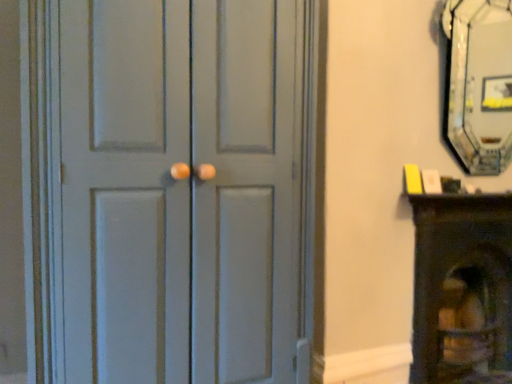
Question: Is matte gray door at center aimed at wooden fireplace at right?

Choices:
 (A) no
 (B) yes

Answer: (A)

Question: Does matte gray door at center have a lesser width compared to wooden fireplace at right?

Choices:
 (A) yes
 (B) no

Answer: (B)

Question: Is matte gray door at center behind wooden fireplace at right?

Choices:
 (A) yes
 (B) no

Answer: (B)

Question: From a real-world perspective, is matte gray door at center under wooden fireplace at right?

Choices:
 (A) no
 (B) yes

Answer: (A)

Question: Are matte gray door at center and wooden fireplace at right far apart?

Choices:
 (A) yes
 (B) no

Answer: (A)

Question: Looking at their shapes, would you say matte gray door at center is wider or thinner than wooden fireplace at right?

Choices:
 (A) wide
 (B) thin

Answer: (A)

Question: From a real-world perspective, is matte gray door at center positioned above or below wooden fireplace at right?

Choices:
 (A) below
 (B) above

Answer: (B)

Question: In terms of height, does matte gray door at center look taller or shorter compared to wooden fireplace at right?

Choices:
 (A) short
 (B) tall

Answer: (B)

Question: From the image's perspective, is matte gray door at center positioned above or below wooden fireplace at right?

Choices:
 (A) above
 (B) below

Answer: (A)

Question: From the image's perspective, is matte gray door at center positioned above or below black glass fireplace at upper right?

Choices:
 (A) above
 (B) below

Answer: (B)

Question: From a real-world perspective, relative to black glass fireplace at upper right, is matte gray door at center vertically above or below?

Choices:
 (A) below
 (B) above

Answer: (A)

Question: In terms of height, does matte gray door at center look taller or shorter compared to black glass fireplace at upper right?

Choices:
 (A) tall
 (B) short

Answer: (A)

Question: Based on their positions, is matte gray door at center located to the left or right of black glass fireplace at upper right?

Choices:
 (A) right
 (B) left

Answer: (B)

Question: From the image's perspective, is wooden fireplace at right located above or below black glass fireplace at upper right?

Choices:
 (A) below
 (B) above

Answer: (A)

Question: Relative to black glass fireplace at upper right, is wooden fireplace at right in front or behind?

Choices:
 (A) behind
 (B) front

Answer: (A)